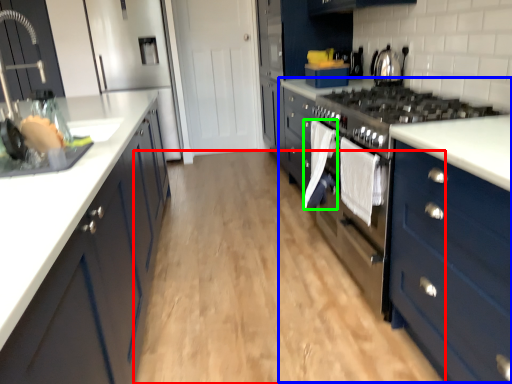
Question: Considering the real-world distances, which object is farthest from plain (highlighted by a red box)? dresser (highlighted by a blue box) or clothe (highlighted by a green box)?

Choices:
 (A) dresser
 (B) clothe

Answer: (B)